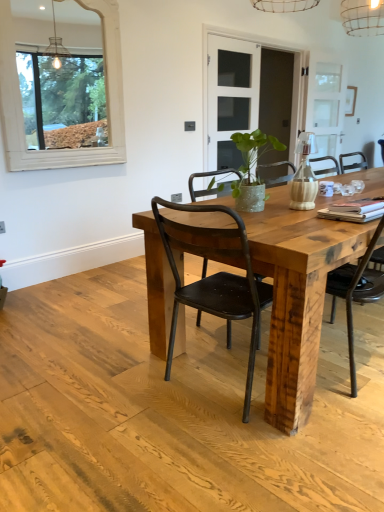
Identify the location of clear glass door at center. The height and width of the screenshot is (512, 384). (251, 102).

Locate an element on the screen. The width and height of the screenshot is (384, 512). white wooden frame at upper left is located at coordinates (20, 103).

Where is `matte white vase at center`? The width and height of the screenshot is (384, 512). matte white vase at center is located at coordinates (304, 175).

Image resolution: width=384 pixels, height=512 pixels. What do you see at coordinates (297, 295) in the screenshot? I see `reclaimed wood table at center` at bounding box center [297, 295].

At what (x,y) coordinates should I click in order to perform the action: click on green textured vase at center. Please return your answer as a coordinate pair (x, y). The height and width of the screenshot is (512, 384). Looking at the image, I should click on (252, 169).

Is the depth of clear glass door at center less than that of matte white vase at center?

No, clear glass door at center is further to the viewer.

Is clear glass door at center inside the boundaries of matte white vase at center, or outside?

clear glass door at center is located beyond the bounds of matte white vase at center.

Find the location of a particular element. The height and width of the screenshot is (512, 384). vase located below the clear glass door at center (from the image's perspective) is located at coordinates (304, 175).

Is point (239, 39) behind point (295, 205)?

Yes, point (239, 39) is behind point (295, 205).

Is green textured vase at center bigger or smaller than clear glass door at center?

green textured vase at center is smaller than clear glass door at center.

Which is behind, green textured vase at center or clear glass door at center?

clear glass door at center is more distant.

Between green textured vase at center and clear glass door at center, which one has more height?

clear glass door at center.

Is point (238, 209) behind point (110, 162)?

No, (238, 209) is closer to viewer.

From the image's perspective, is green textured vase at center below white wooden frame at upper left?

Yes, from the image's perspective, green textured vase at center is below white wooden frame at upper left.

Considering the relative sizes of green textured vase at center and white wooden frame at upper left in the image provided, is green textured vase at center bigger than white wooden frame at upper left?

No.

Is green textured vase at center inside the boundaries of white wooden frame at upper left, or outside?

green textured vase at center lies outside white wooden frame at upper left.

Looking at this image, is clear glass door at center at the back of reclaimed wood table at center?

No, reclaimed wood table at center's orientation is not away from clear glass door at center.

Which object is thinner, reclaimed wood table at center or clear glass door at center?

clear glass door at center is thinner.

From a real-world perspective, is reclaimed wood table at center on top of clear glass door at center?

No, from a real-world perspective, reclaimed wood table at center is not over clear glass door at center

Is reclaimed wood table at center spatially inside clear glass door at center, or outside of it?

reclaimed wood table at center is not inside clear glass door at center, it's outside.

From the image's perspective, is matte white vase at center on reclaimed wood table at center?

Indeed, from the image's perspective, matte white vase at center is shown above reclaimed wood table at center.

Identify the location of kitchen & dining room table on the right of matte white vase at center. (297, 295).

Between matte white vase at center and reclaimed wood table at center, which one appears on the left side from the viewer's perspective?

Positioned to the left is matte white vase at center.

Is matte white vase at center directly adjacent to reclaimed wood table at center?

No, matte white vase at center is not with reclaimed wood table at center.

Would you say reclaimed wood table at center is inside or outside green textured vase at center?

The correct answer is: outside.

From the image's perspective, is reclaimed wood table at center located above or below green textured vase at center?

Clearly, from the image's perspective, reclaimed wood table at center is below green textured vase at center.

From a real-world perspective, is reclaimed wood table at center positioned over green textured vase at center based on gravity?

No, from a real-world perspective, reclaimed wood table at center is not above green textured vase at center.

Is reclaimed wood table at center not close to green textured vase at center?

No, there isn't a large distance between reclaimed wood table at center and green textured vase at center.

Is matte white vase at center to the right of white wooden frame at upper left from the viewer's perspective?

Yes.

Can you confirm if matte white vase at center is wider than white wooden frame at upper left?

Yes.

The height and width of the screenshot is (512, 384). I want to click on window positioned vertically above the matte white vase at center (from a real-world perspective), so click(x=20, y=103).

From the image's perspective, is matte white vase at center under white wooden frame at upper left?

Yes.

Where is `glass door lying behind the matte white vase at center`? This screenshot has width=384, height=512. glass door lying behind the matte white vase at center is located at coordinates (251, 102).

I want to click on glass door lying on the right of green textured vase at center, so click(251, 102).

Based on their spatial positions, is reclaimed wood table at center or white wooden frame at upper left closer to green textured vase at center?

Based on the image, reclaimed wood table at center appears to be nearer to green textured vase at center.

From the picture: Considering their positions, is reclaimed wood table at center positioned closer to matte white vase at center than white wooden frame at upper left?

reclaimed wood table at center.

Based on their spatial positions, is green textured vase at center or white wooden frame at upper left further from clear glass door at center?

green textured vase at center lies further to clear glass door at center than the other object.

When comparing their distances from clear glass door at center, does reclaimed wood table at center or matte white vase at center seem closer?

matte white vase at center is positioned closer to the anchor clear glass door at center.

Estimate the real-world distances between objects in this image. Which object is further from green textured vase at center, reclaimed wood table at center or matte white vase at center?

reclaimed wood table at center is positioned further to the anchor green textured vase at center.

In the scene shown: From the image, which object appears to be nearer to white wooden frame at upper left, green textured vase at center or reclaimed wood table at center?

green textured vase at center is positioned closer to the anchor white wooden frame at upper left.

From the image, which object appears to be farther from white wooden frame at upper left, green textured vase at center or matte white vase at center?

matte white vase at center.

Which object lies nearer to the anchor point matte white vase at center, green textured vase at center or reclaimed wood table at center?

Among the two, green textured vase at center is located nearer to matte white vase at center.

The width and height of the screenshot is (384, 512). In order to click on window located between green textured vase at center and clear glass door at center in the depth direction in this screenshot , I will do `click(20, 103)`.

At what (x,y) coordinates should I click in order to perform the action: click on window between matte white vase at center and clear glass door at center in the front-back direction. Please return your answer as a coordinate pair (x, y). This screenshot has height=512, width=384. Looking at the image, I should click on (20, 103).

You are a GUI agent. You are given a task and a screenshot of the screen. Output one action in this format:
    pyautogui.click(x=<x>, y=<y>)
    Task: Click on the vase between green textured vase at center and clear glass door at center along the z-axis
    This screenshot has height=512, width=384.
    Given the screenshot: What is the action you would take?
    pyautogui.click(x=304, y=175)

The height and width of the screenshot is (512, 384). What are the coordinates of `houseplant located between white wooden frame at upper left and reclaimed wood table at center in the left-right direction` in the screenshot? It's located at (252, 169).